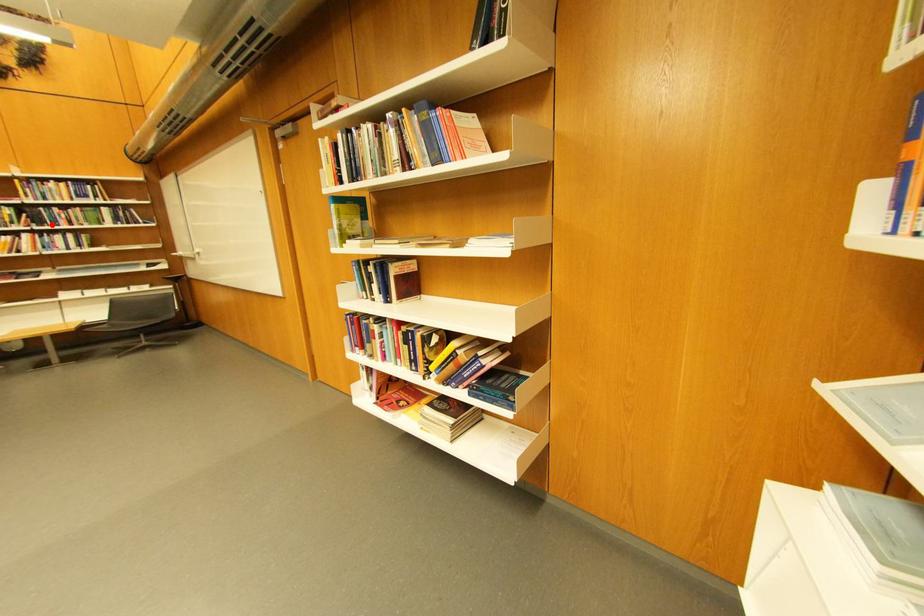
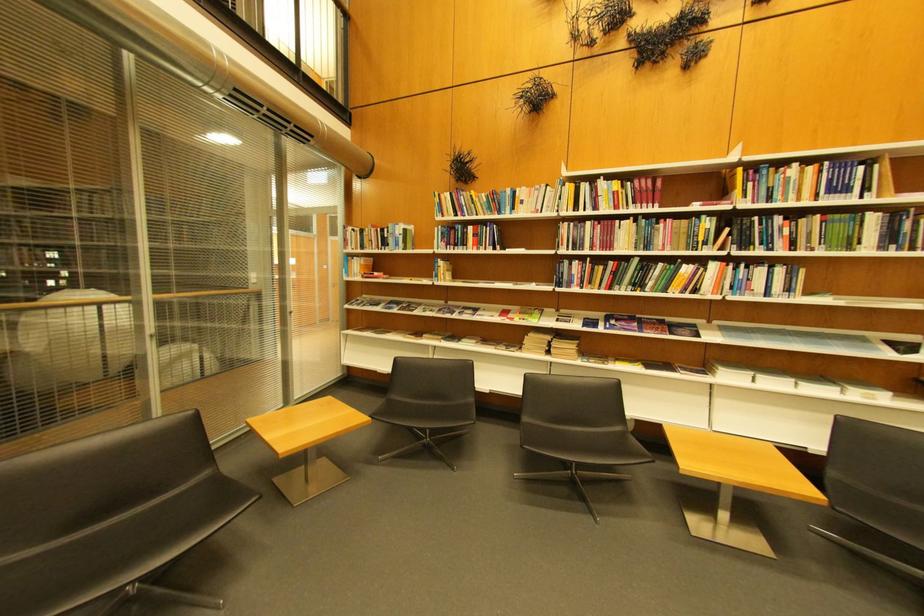
Question: I am providing you with two images of the same scene from different viewpoints. In image1, a red point is highlighted. Considering the same 3D point in image2, which of the following is correct?

Choices:
 (A) It is closer
 (B) It is farther

Answer: (A)